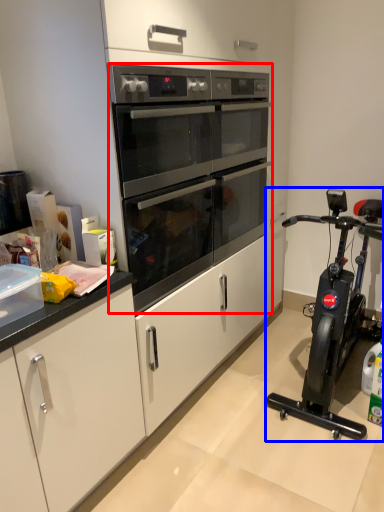
Question: Among these objects, which one is nearest to the camera, oven (highlighted by a red box) or home appliance (highlighted by a blue box)?

Choices:
 (A) oven
 (B) home appliance

Answer: (B)